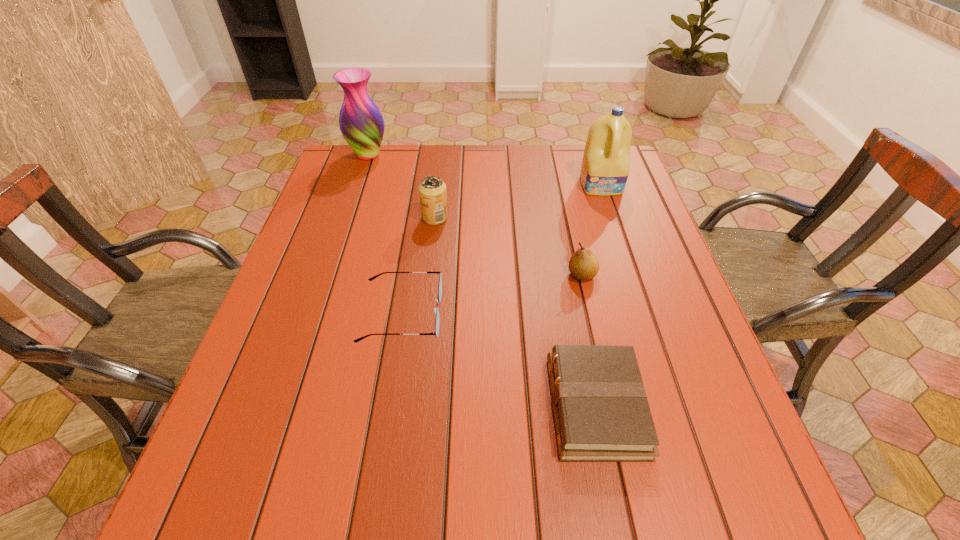
Locate an element on the screen. This screenshot has height=540, width=960. vacant area that lies between the pear and the leftmost object is located at coordinates (475, 215).

At what (x,y) coordinates should I click in order to perform the action: click on vacant point located between the second farthest object and the leftmost object. Please return your answer as a coordinate pair (x, y). The width and height of the screenshot is (960, 540). Looking at the image, I should click on (485, 170).

Locate an element on the screen. empty space between the detergent and the spectacles is located at coordinates (502, 249).

Where is `vacant space that's between the fourth shortest object and the nearest object`? vacant space that's between the fourth shortest object and the nearest object is located at coordinates (516, 312).

At what (x,y) coordinates should I click in order to perform the action: click on vacant space that is in between the fourth tallest object and the fourth nearest object. Please return your answer as a coordinate pair (x, y). Image resolution: width=960 pixels, height=540 pixels. Looking at the image, I should click on (509, 246).

Find the location of a particular element. The image size is (960, 540). unoccupied area between the rightmost object and the spectacles is located at coordinates (502, 249).

Find the location of a particular element. unoccupied area between the third shortest object and the leftmost object is located at coordinates click(475, 215).

Locate an element on the screen. This screenshot has width=960, height=540. vacant region between the pear and the leftmost object is located at coordinates (475, 215).

You are a GUI agent. You are given a task and a screenshot of the screen. Output one action in this format:
    pyautogui.click(x=<x>, y=<y>)
    Task: Click on the free space between the nearest object and the farthest object
    The image size is (960, 540).
    Given the screenshot: What is the action you would take?
    pyautogui.click(x=482, y=280)

Select which object is the third closest to the farthest object. Please provide its 2D coordinates. Your answer should be formatted as a tuple, i.e. [(x, y)], where the tuple contains the x and y coordinates of a point satisfying the conditions above.

[(605, 168)]